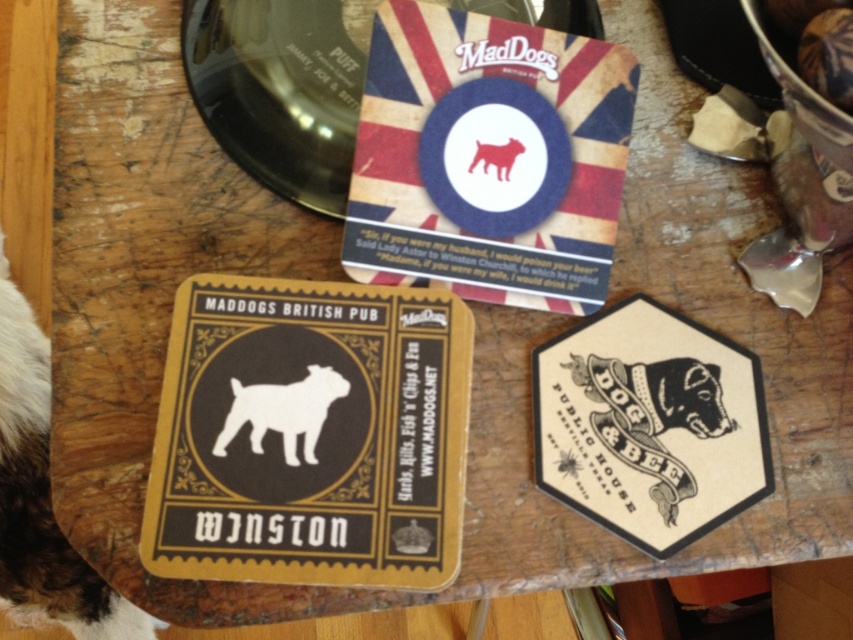
Question: Does matte black coaster at center come in front of matte paper coaster at center?

Choices:
 (A) yes
 (B) no

Answer: (A)

Question: Which object appears farthest from the camera in this image?

Choices:
 (A) matte paper coaster at center
 (B) matte white dog at center

Answer: (B)

Question: Is matte black coaster at center above white paper dog at center?

Choices:
 (A) yes
 (B) no

Answer: (B)

Question: Can you confirm if matte black coaster at center is positioned below matte white dog at center?

Choices:
 (A) no
 (B) yes

Answer: (B)

Question: Which object is the farthest from the white paper hexagon at lower right?

Choices:
 (A) matte white dog at center
 (B) white paper dog at center
 (C) matte black coaster at center

Answer: (B)

Question: Which of the following is the farthest from the observer?

Choices:
 (A) (612, 323)
 (B) (292, 381)

Answer: (A)